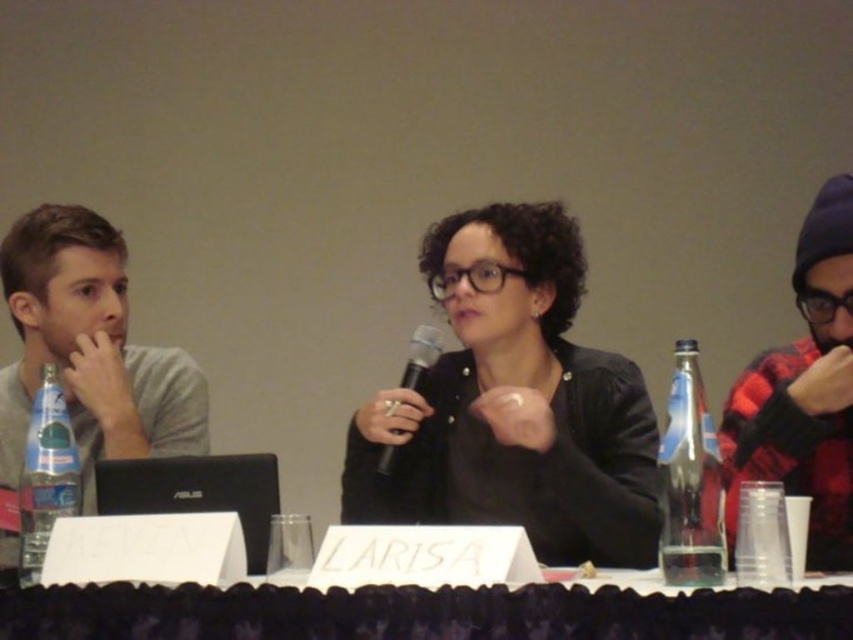
Question: Among these objects, which one is nearest to the camera?

Choices:
 (A) clear glass bottle at center
 (B) clear plastic bottle at left
 (C) white plastic table at center

Answer: (C)

Question: Is black matte jacket at center above clear glass bottle at center?

Choices:
 (A) no
 (B) yes

Answer: (B)

Question: Which object is positioned farthest from the clear plastic bottle at left?

Choices:
 (A) white plastic table at center
 (B) red plaid shirt at right
 (C) black matte microphone at center

Answer: (B)

Question: Can you confirm if gray matte shirt at left is positioned above clear glass bottle at center?

Choices:
 (A) yes
 (B) no

Answer: (A)

Question: Is the position of white plastic table at center more distant than that of red plaid shirt at right?

Choices:
 (A) yes
 (B) no

Answer: (B)

Question: Which of the following is the farthest from the observer?

Choices:
 (A) black matte jacket at center
 (B) black matte microphone at center
 (C) clear plastic bottle at left

Answer: (B)